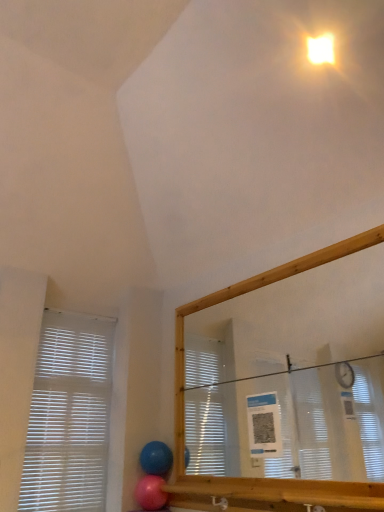
Find the location of a particular element. blue rubber balloon at lower center, the first balloon from the top is located at coordinates (156, 458).

What is the approximate width of bright yellow plastic light at upper right?

bright yellow plastic light at upper right is 1.89 inches in width.

Where is `bright yellow plastic light at upper right`? The height and width of the screenshot is (512, 384). bright yellow plastic light at upper right is located at coordinates (321, 49).

The height and width of the screenshot is (512, 384). I want to click on pink rubber balloon at lower center, acting as the 2th balloon starting from the top, so click(150, 493).

This screenshot has width=384, height=512. What are the coordinates of `blue rubber balloon at lower center, the first balloon from the top` in the screenshot? It's located at (156, 458).

Considering the relative sizes of blue rubber balloon at lower center, the second balloon from the bottom, and pink rubber balloon at lower center, positioned as the first balloon in bottom-to-top order, in the image provided, is blue rubber balloon at lower center, the second balloon from the bottom, thinner than pink rubber balloon at lower center, positioned as the first balloon in bottom-to-top order,?

Indeed, blue rubber balloon at lower center, the second balloon from the bottom, has a lesser width compared to pink rubber balloon at lower center, positioned as the first balloon in bottom-to-top order.

Choose the correct answer: Is blue rubber balloon at lower center, the first balloon from the top, inside pink rubber balloon at lower center, acting as the 2th balloon starting from the top, or outside it?

blue rubber balloon at lower center, the first balloon from the top, is outside pink rubber balloon at lower center, acting as the 2th balloon starting from the top.

Who is bigger, blue rubber balloon at lower center, the second balloon from the bottom, or pink rubber balloon at lower center, acting as the 2th balloon starting from the top?

Bigger between the two is blue rubber balloon at lower center, the second balloon from the bottom.

Looking at their sizes, would you say pink rubber balloon at lower center, positioned as the first balloon in bottom-to-top order, is wider or thinner than blue rubber balloon at lower center, the first balloon from the top?

Clearly, pink rubber balloon at lower center, positioned as the first balloon in bottom-to-top order, has more width compared to blue rubber balloon at lower center, the first balloon from the top.

Would you say blue rubber balloon at lower center, the second balloon from the bottom, is part of pink rubber balloon at lower center, positioned as the first balloon in bottom-to-top order,'s contents?

That's incorrect, blue rubber balloon at lower center, the second balloon from the bottom, is not inside pink rubber balloon at lower center, positioned as the first balloon in bottom-to-top order.

In the scene shown: How many degrees apart are the facing directions of pink rubber balloon at lower center, positioned as the first balloon in bottom-to-top order, and blue rubber balloon at lower center, the second balloon from the bottom?

The angle between the facing direction of pink rubber balloon at lower center, positioned as the first balloon in bottom-to-top order, and the facing direction of blue rubber balloon at lower center, the second balloon from the bottom, is 0.000478 degrees.

Is point (161, 484) closer to camera compared to point (154, 472)?

Yes, it is in front of point (154, 472).

Between pink rubber balloon at lower center, acting as the 2th balloon starting from the top, and bright yellow plastic light at upper right, which one has more height?

pink rubber balloon at lower center, acting as the 2th balloon starting from the top, is taller.

At what (x,y) coordinates should I click in order to perform the action: click on light that appears on the right of pink rubber balloon at lower center, positioned as the first balloon in bottom-to-top order. Please return your answer as a coordinate pair (x, y). Image resolution: width=384 pixels, height=512 pixels. Looking at the image, I should click on (321, 49).

Is pink rubber balloon at lower center, acting as the 2th balloon starting from the top, oriented towards bright yellow plastic light at upper right?

No, pink rubber balloon at lower center, acting as the 2th balloon starting from the top, is not facing towards bright yellow plastic light at upper right.

Is blue rubber balloon at lower center, the second balloon from the bottom, looking in the opposite direction of bright yellow plastic light at upper right?

No, bright yellow plastic light at upper right is not at the back of blue rubber balloon at lower center, the second balloon from the bottom.

Considering the sizes of objects blue rubber balloon at lower center, the first balloon from the top, and bright yellow plastic light at upper right in the image provided, who is taller, blue rubber balloon at lower center, the first balloon from the top, or bright yellow plastic light at upper right?

blue rubber balloon at lower center, the first balloon from the top.

Looking at this image, from a real-world perspective, is blue rubber balloon at lower center, the first balloon from the top, under bright yellow plastic light at upper right?

Yes.

Is blue rubber balloon at lower center, the first balloon from the top, placed right next to bright yellow plastic light at upper right?

No, blue rubber balloon at lower center, the first balloon from the top, is not making contact with bright yellow plastic light at upper right.

From the picture: Is blue rubber balloon at lower center, the first balloon from the top, surrounded by white plastic blinds at left?

Definitely not — blue rubber balloon at lower center, the first balloon from the top, is not inside white plastic blinds at left.

Does white plastic blinds at left have a lesser width compared to blue rubber balloon at lower center, the first balloon from the top?

Yes.

Is white plastic blinds at left closer to camera compared to blue rubber balloon at lower center, the first balloon from the top?

Yes.

Is white plastic blinds at left at the left side of blue rubber balloon at lower center, the first balloon from the top?

Yes, white plastic blinds at left is to the left of blue rubber balloon at lower center, the first balloon from the top.

Between pink rubber balloon at lower center, positioned as the first balloon in bottom-to-top order, and white plastic blinds at left, which one has smaller size?

pink rubber balloon at lower center, positioned as the first balloon in bottom-to-top order, is smaller.

Find the location of a particular element. The width and height of the screenshot is (384, 512). window blind on the left of pink rubber balloon at lower center, positioned as the first balloon in bottom-to-top order is located at coordinates (69, 416).

From the image's perspective, which is above, pink rubber balloon at lower center, acting as the 2th balloon starting from the top, or white plastic blinds at left?

white plastic blinds at left is shown above in the image.

Can you confirm if bright yellow plastic light at upper right is taller than blue rubber balloon at lower center, the second balloon from the bottom?

Incorrect, the height of bright yellow plastic light at upper right is not larger of that of blue rubber balloon at lower center, the second balloon from the bottom.

In the scene shown: Is bright yellow plastic light at upper right wider or thinner than blue rubber balloon at lower center, the first balloon from the top?

bright yellow plastic light at upper right is thinner than blue rubber balloon at lower center, the first balloon from the top.

This screenshot has height=512, width=384. I want to click on the 1st balloon below the bright yellow plastic light at upper right (from the image's perspective), so click(x=156, y=458).

From the picture: Is bright yellow plastic light at upper right oriented away from blue rubber balloon at lower center, the second balloon from the bottom?

bright yellow plastic light at upper right does not have its back to blue rubber balloon at lower center, the second balloon from the bottom.

This screenshot has width=384, height=512. Identify the location of balloon located on the left of blue rubber balloon at lower center, the first balloon from the top. (150, 493).

In order to click on balloon lying in front of the blue rubber balloon at lower center, the second balloon from the bottom in this screenshot , I will do `click(150, 493)`.

When comparing their distances from white plastic blinds at left, does blue rubber balloon at lower center, the second balloon from the bottom, or pink rubber balloon at lower center, acting as the 2th balloon starting from the top, seem closer?

blue rubber balloon at lower center, the second balloon from the bottom, is closer to white plastic blinds at left.

Looking at the image, which one is located further to bright yellow plastic light at upper right, pink rubber balloon at lower center, acting as the 2th balloon starting from the top, or blue rubber balloon at lower center, the first balloon from the top?

pink rubber balloon at lower center, acting as the 2th balloon starting from the top, is positioned further to the anchor bright yellow plastic light at upper right.

Which object lies further to the anchor point blue rubber balloon at lower center, the second balloon from the bottom, pink rubber balloon at lower center, positioned as the first balloon in bottom-to-top order, or white plastic blinds at left?

white plastic blinds at left.

Considering their positions, is bright yellow plastic light at upper right positioned further to blue rubber balloon at lower center, the first balloon from the top, than white plastic blinds at left?

bright yellow plastic light at upper right.

Considering their positions, is bright yellow plastic light at upper right positioned closer to pink rubber balloon at lower center, positioned as the first balloon in bottom-to-top order, than blue rubber balloon at lower center, the first balloon from the top?

blue rubber balloon at lower center, the first balloon from the top, is closer to pink rubber balloon at lower center, positioned as the first balloon in bottom-to-top order.

Considering their positions, is white plastic blinds at left positioned further to bright yellow plastic light at upper right than pink rubber balloon at lower center, positioned as the first balloon in bottom-to-top order?

pink rubber balloon at lower center, positioned as the first balloon in bottom-to-top order, is further to bright yellow plastic light at upper right.

Looking at the image, which one is located closer to blue rubber balloon at lower center, the second balloon from the bottom, bright yellow plastic light at upper right or pink rubber balloon at lower center, positioned as the first balloon in bottom-to-top order?

pink rubber balloon at lower center, positioned as the first balloon in bottom-to-top order, is positioned closer to the anchor blue rubber balloon at lower center, the second balloon from the bottom.

Looking at this image, estimate the real-world distances between objects in this image. Which object is further from bright yellow plastic light at upper right, white plastic blinds at left or blue rubber balloon at lower center, the second balloon from the bottom?

white plastic blinds at left is positioned further to the anchor bright yellow plastic light at upper right.

You are a GUI agent. You are given a task and a screenshot of the screen. Output one action in this format:
    pyautogui.click(x=<x>, y=<y>)
    Task: Click on the window blind that lies between bright yellow plastic light at upper right and blue rubber balloon at lower center, the second balloon from the bottom, from top to bottom
    
    Given the screenshot: What is the action you would take?
    pyautogui.click(x=69, y=416)

Find the location of a particular element. The height and width of the screenshot is (512, 384). balloon that lies between bright yellow plastic light at upper right and pink rubber balloon at lower center, positioned as the first balloon in bottom-to-top order, from top to bottom is located at coordinates (156, 458).

Where is `balloon between white plastic blinds at left and blue rubber balloon at lower center, the first balloon from the top, from left to right`? This screenshot has width=384, height=512. balloon between white plastic blinds at left and blue rubber balloon at lower center, the first balloon from the top, from left to right is located at coordinates (150, 493).

At what (x,y) coordinates should I click in order to perform the action: click on window blind that lies between bright yellow plastic light at upper right and pink rubber balloon at lower center, positioned as the first balloon in bottom-to-top order, from top to bottom. Please return your answer as a coordinate pair (x, y). The width and height of the screenshot is (384, 512). Looking at the image, I should click on (69, 416).